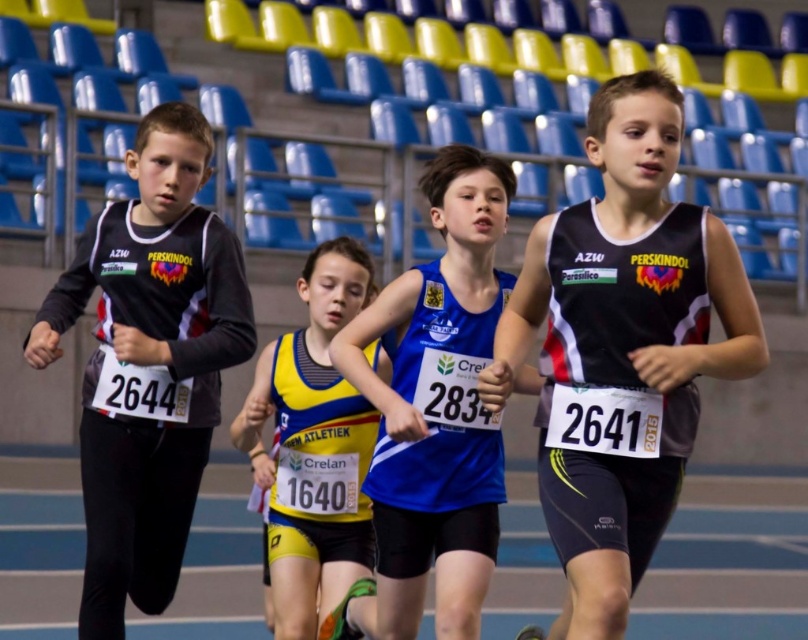
Which is in front, point (579, 298) or point (316, 387)?

Point (579, 298) is more forward.

Can you confirm if black mesh tank top at right is positioned to the left of yellow and black jersey at center?

No, black mesh tank top at right is not to the left of yellow and black jersey at center.

Is point (697, 220) closer to camera compared to point (282, 502)?

Yes, it is.

At what (x,y) coordinates should I click in order to perform the action: click on black mesh tank top at right. Please return your answer as a coordinate pair (x, y). Looking at the image, I should click on coord(623,340).

Can you confirm if blue fabric running suit at center is taller than yellow and black jersey at center?

Yes.

Can you confirm if blue fabric running suit at center is smaller than yellow and black jersey at center?

Incorrect, blue fabric running suit at center is not smaller in size than yellow and black jersey at center.

Is point (381, 560) positioned before point (280, 499)?

Yes, it is in front of point (280, 499).

Where is `blue fabric running suit at center`? blue fabric running suit at center is located at coordinates (432, 413).

Who is positioned more to the right, black mesh tank top at right or matte black long-sleeve shirt at left?

Positioned to the right is black mesh tank top at right.

Between black mesh tank top at right and matte black long-sleeve shirt at left, which one is positioned lower?

black mesh tank top at right is lower down.

Which is in front, point (553, 237) or point (190, 160)?

Positioned in front is point (553, 237).

I want to click on black mesh tank top at right, so [623, 340].